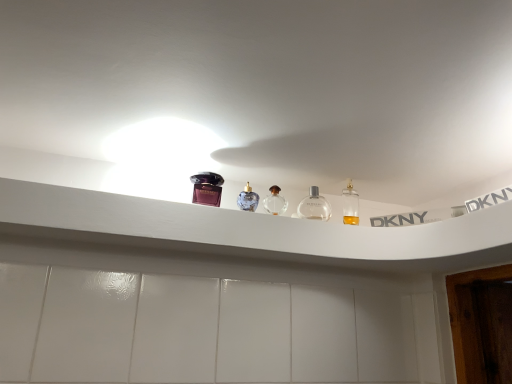
Question: Does matte purple perfume at upper center have a greater width compared to clear glass bottle at center, acting as the 2th bottle starting from the left?

Choices:
 (A) yes
 (B) no

Answer: (A)

Question: Is matte purple perfume at upper center positioned with its back to clear glass bottle at center, which is the 1th bottle from right to left?

Choices:
 (A) no
 (B) yes

Answer: (A)

Question: From the image's perspective, is matte purple perfume at upper center above clear glass bottle at center, which is the 1th bottle from right to left?

Choices:
 (A) yes
 (B) no

Answer: (A)

Question: From a real-world perspective, is matte purple perfume at upper center on clear glass bottle at center, acting as the 2th bottle starting from the left?

Choices:
 (A) yes
 (B) no

Answer: (A)

Question: Can you confirm if matte purple perfume at upper center is shorter than clear glass bottle at center, acting as the 2th bottle starting from the left?

Choices:
 (A) no
 (B) yes

Answer: (A)

Question: Is matte purple perfume at upper center outside clear glass bottle at center, which is the 1th bottle from right to left?

Choices:
 (A) no
 (B) yes

Answer: (B)

Question: Is white plastic shelf at upper center located within clear glass bottle at center, which is the 1th bottle from right to left?

Choices:
 (A) no
 (B) yes

Answer: (A)

Question: Is clear glass bottle at center, acting as the 2th bottle starting from the left, shorter than white plastic shelf at upper center?

Choices:
 (A) no
 (B) yes

Answer: (A)

Question: Does clear glass bottle at center, which is the 1th bottle from right to left, lie behind white plastic shelf at upper center?

Choices:
 (A) yes
 (B) no

Answer: (A)

Question: Is clear glass bottle at center, acting as the 2th bottle starting from the left, to the right of white plastic shelf at upper center from the viewer's perspective?

Choices:
 (A) no
 (B) yes

Answer: (B)

Question: Can you confirm if clear glass bottle at center, which is the 1th bottle from right to left, is wider than white plastic shelf at upper center?

Choices:
 (A) no
 (B) yes

Answer: (A)

Question: Is clear glass bottle at center, which is the 1th bottle from right to left, outside white plastic shelf at upper center?

Choices:
 (A) yes
 (B) no

Answer: (A)

Question: From the image's perspective, would you say clear glass perfume at center, the 1th bottle from the left, is positioned over matte purple perfume at upper center?

Choices:
 (A) yes
 (B) no

Answer: (B)